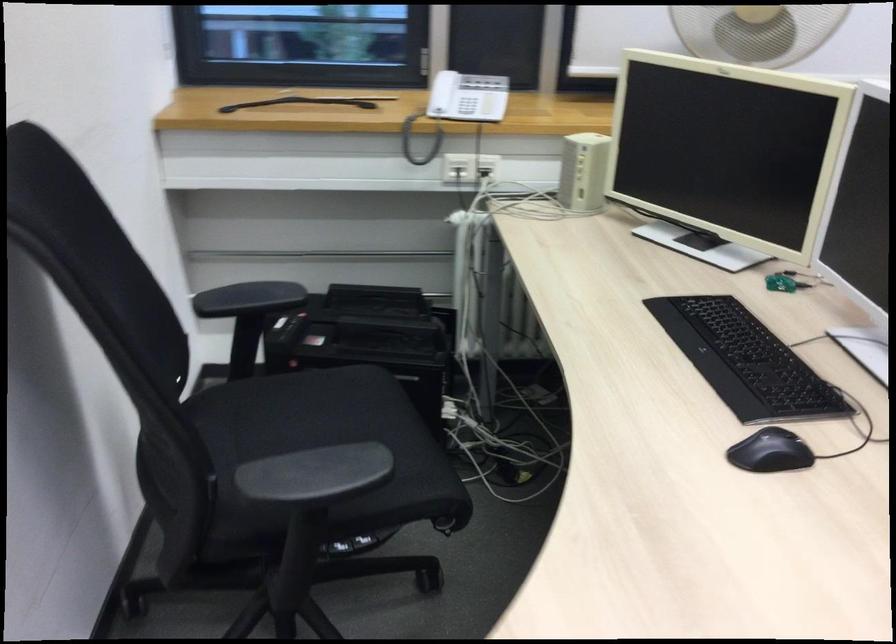
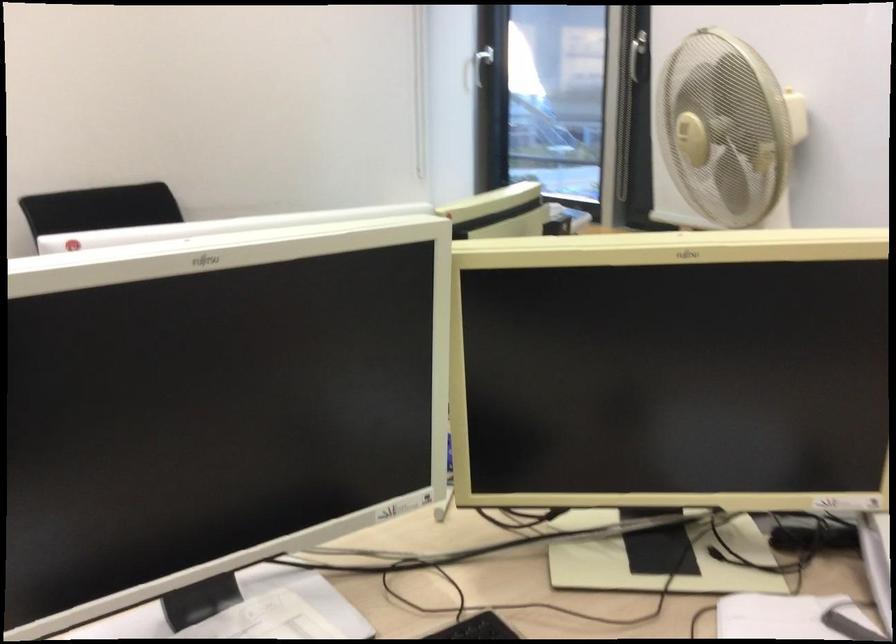
Question: I am providing you with two images of the same scene from different viewpoints. Please identify which objects are invisible in image2.

Choices:
 (A) white window handle
 (B) black chair armrest
 (C) fan control knob
 (D) kettle lid switch

Answer: (B)